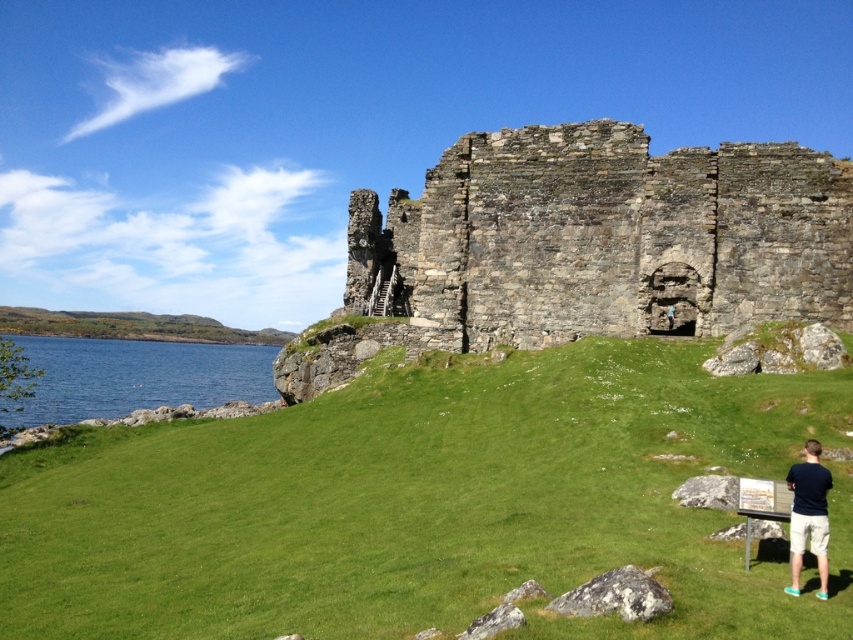
Question: Which of the following is the closest to the observer?

Choices:
 (A) dark blue shirt at lower right
 (B) green grassy hill at left
 (C) rustic stone castle at center
 (D) green grassy at center

Answer: (D)

Question: Which of these objects is positioned farthest from the dark blue shirt at lower right?

Choices:
 (A) green grassy hill at left
 (B) rustic stone castle at center

Answer: (A)

Question: Which object appears closest to the camera in this image?

Choices:
 (A) blue water at lower left
 (B) green grassy hill at left

Answer: (A)

Question: Considering the relative positions of green grassy at center and rustic stone castle at center in the image provided, where is green grassy at center located with respect to rustic stone castle at center?

Choices:
 (A) right
 (B) left

Answer: (B)

Question: Can you confirm if rustic stone castle at center is wider than blue water at lower left?

Choices:
 (A) no
 (B) yes

Answer: (A)

Question: Is green grassy at center bigger than dark blue shirt at lower right?

Choices:
 (A) no
 (B) yes

Answer: (B)